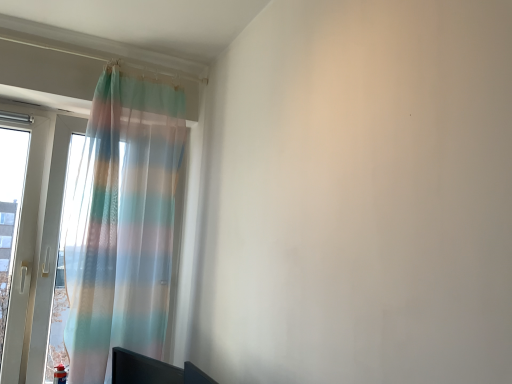
Question: Should I look upward or downward to see black glossy monitor at lower left?

Choices:
 (A) down
 (B) up

Answer: (A)

Question: Is the surface of translucent pastel striped curtain at left in direct contact with black glossy monitor at lower left?

Choices:
 (A) no
 (B) yes

Answer: (A)

Question: Could you tell me if translucent pastel striped curtain at left is turned towards black glossy monitor at lower left?

Choices:
 (A) yes
 (B) no

Answer: (A)

Question: Is translucent pastel striped curtain at left to the left of black glossy monitor at lower left from the viewer's perspective?

Choices:
 (A) yes
 (B) no

Answer: (A)

Question: Does translucent pastel striped curtain at left have a greater height compared to black glossy monitor at lower left?

Choices:
 (A) no
 (B) yes

Answer: (B)

Question: Does translucent pastel striped curtain at left have a smaller size compared to black glossy monitor at lower left?

Choices:
 (A) yes
 (B) no

Answer: (B)

Question: From the image's perspective, is translucent pastel striped curtain at left under black glossy monitor at lower left?

Choices:
 (A) no
 (B) yes

Answer: (A)

Question: Are black glossy monitor at lower left and translucent pastel striped curtain at left making contact?

Choices:
 (A) no
 (B) yes

Answer: (A)

Question: Is black glossy monitor at lower left smaller than translucent pastel striped curtain at left?

Choices:
 (A) yes
 (B) no

Answer: (A)

Question: Is translucent pastel striped curtain at left surrounded by black glossy monitor at lower left?

Choices:
 (A) yes
 (B) no

Answer: (B)

Question: Can you confirm if black glossy monitor at lower left is shorter than translucent pastel striped curtain at left?

Choices:
 (A) yes
 (B) no

Answer: (A)

Question: Can you confirm if black glossy monitor at lower left is wider than translucent pastel striped curtain at left?

Choices:
 (A) no
 (B) yes

Answer: (A)

Question: From a real-world perspective, is black glossy monitor at lower left over translucent pastel striped curtain at left?

Choices:
 (A) yes
 (B) no

Answer: (B)

Question: In the image, is translucent pastel striped curtain at left on the left side or the right side of black glossy monitor at lower left?

Choices:
 (A) left
 (B) right

Answer: (A)